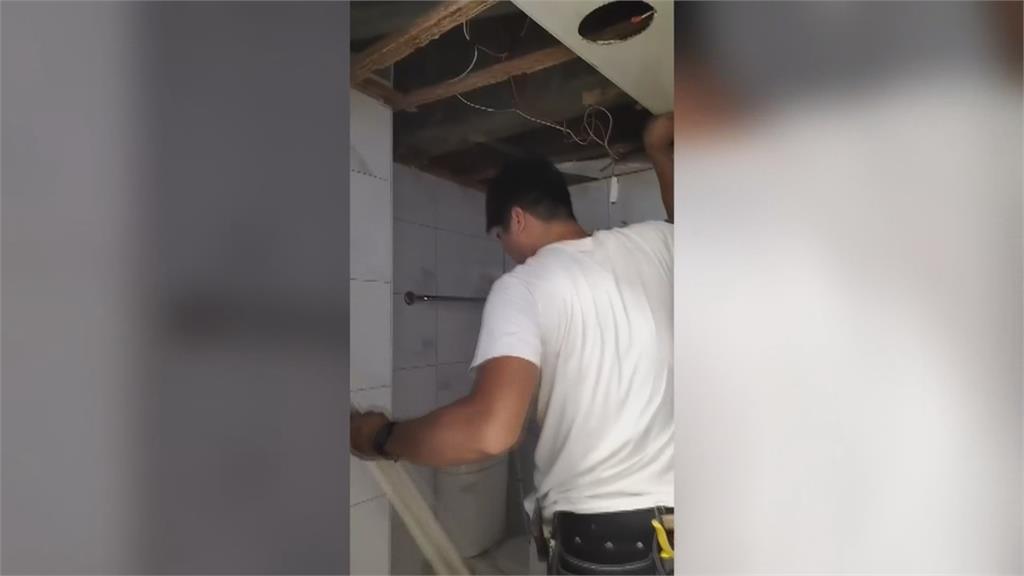
In order to click on wires in this screenshot , I will do `click(463, 70)`, `click(494, 53)`.